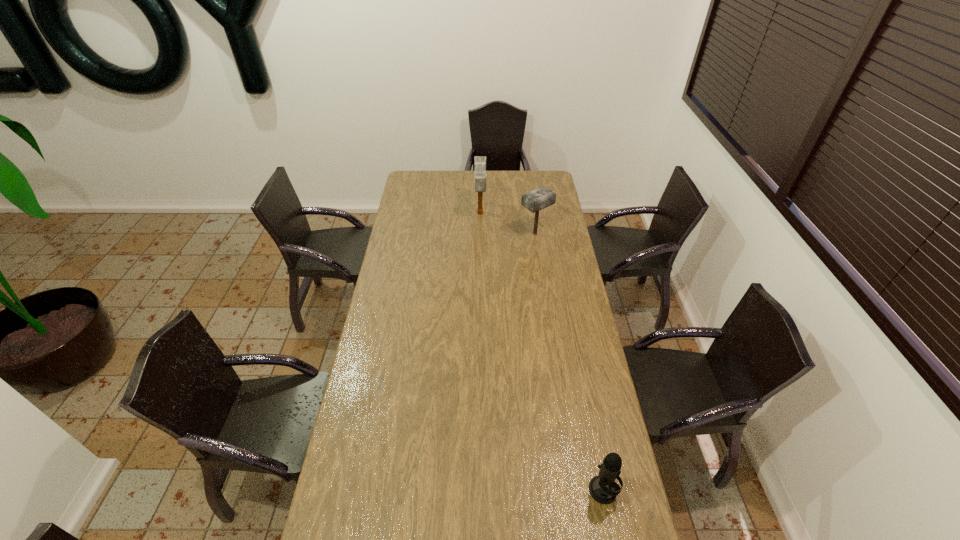
Find the location of a particular element. blank space at the right edge of the desktop is located at coordinates (601, 457).

The width and height of the screenshot is (960, 540). Find the location of `free space at the far left corner of the desktop`. free space at the far left corner of the desktop is located at coordinates (410, 181).

Image resolution: width=960 pixels, height=540 pixels. I want to click on vacant space at the far right corner, so click(533, 185).

Find the location of a particular element. blank region between the nearest object and the right mallet is located at coordinates (569, 362).

At what (x,y) coordinates should I click in order to perform the action: click on empty location between the right mallet and the leftmost object. Please return your answer as a coordinate pair (x, y). This screenshot has width=960, height=540. Looking at the image, I should click on (508, 224).

This screenshot has width=960, height=540. I want to click on vacant region between the left mallet and the right mallet, so click(508, 224).

The image size is (960, 540). I want to click on free space between the right mallet and the shortest object, so click(569, 362).

At what (x,y) coordinates should I click in order to perform the action: click on vacant area that lies between the leftmost object and the right mallet. Please return your answer as a coordinate pair (x, y). Looking at the image, I should click on (508, 224).

At what (x,y) coordinates should I click in order to perform the action: click on vacant area that lies between the right mallet and the microphone. Please return your answer as a coordinate pair (x, y). The width and height of the screenshot is (960, 540). Looking at the image, I should click on (569, 362).

This screenshot has height=540, width=960. Find the location of `free space between the left mallet and the right mallet`. free space between the left mallet and the right mallet is located at coordinates (508, 224).